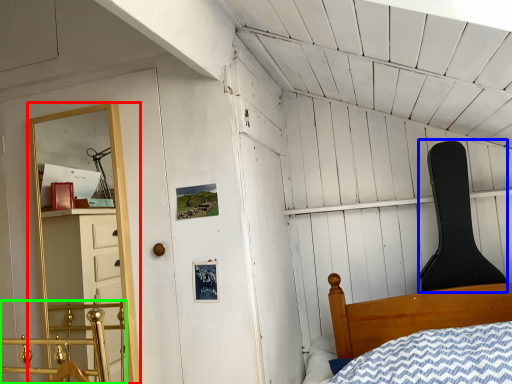
Question: Which object is the closest to the shelf (highlighted by a red box)? Choose among these: chair (highlighted by a blue box) or rail (highlighted by a green box).

Choices:
 (A) chair
 (B) rail

Answer: (B)